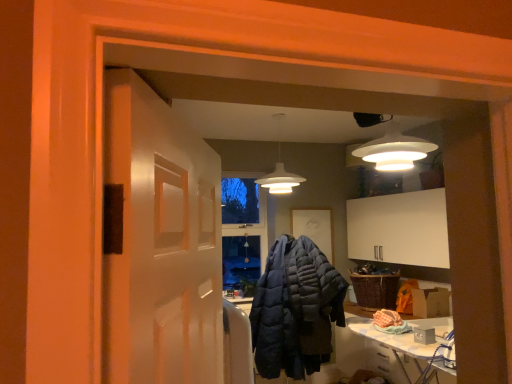
Question: From the image's perspective, is white ironing board at lower right above or below white matte pendant light at center?

Choices:
 (A) below
 (B) above

Answer: (A)

Question: From a real-world perspective, is white ironing board at lower right positioned above or below white matte pendant light at center?

Choices:
 (A) above
 (B) below

Answer: (B)

Question: Based on their relative distances, which object is nearer to the white glossy door at center?

Choices:
 (A) white matte pendant light at center
 (B) woven brown basket at lower right
 (C) dark blue quilted jacket at center
 (D) white ironing board at lower right

Answer: (D)

Question: Which is farther from the white glossy door at center?

Choices:
 (A) white matte pendant light at center
 (B) dark blue quilted jacket at center
 (C) white ironing board at lower right
 (D) woven brown basket at lower right

Answer: (D)